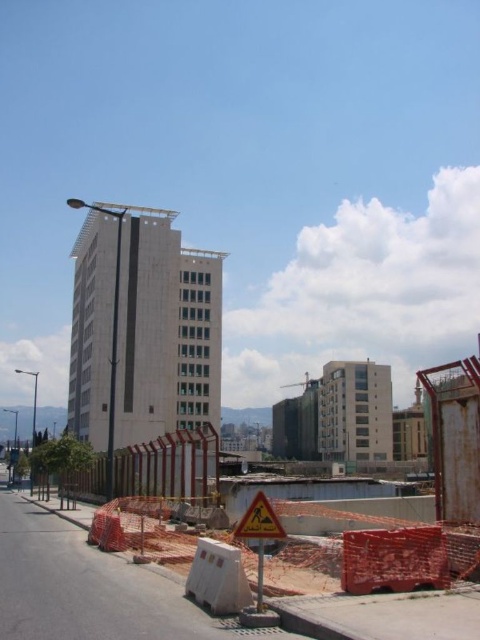
Question: Does white smooth building at center appear on the left side of orange mesh fence at center?

Choices:
 (A) no
 (B) yes

Answer: (B)

Question: Among these points, which one is farthest from the camera?

Choices:
 (A) (127, 225)
 (B) (233, 532)
 (C) (116, 557)

Answer: (A)

Question: Which point appears farthest from the camera in this image?

Choices:
 (A) (412, 625)
 (B) (132, 435)

Answer: (B)

Question: Does white smooth building at center lie in front of yellow reflective triangle at center?

Choices:
 (A) no
 (B) yes

Answer: (A)

Question: Is orange mesh fence at center further to the viewer compared to yellow reflective triangle at center?

Choices:
 (A) yes
 (B) no

Answer: (B)

Question: Which object is positioned closest to the yellow reflective triangle at center?

Choices:
 (A) orange mesh fence at center
 (B) white smooth building at center

Answer: (A)